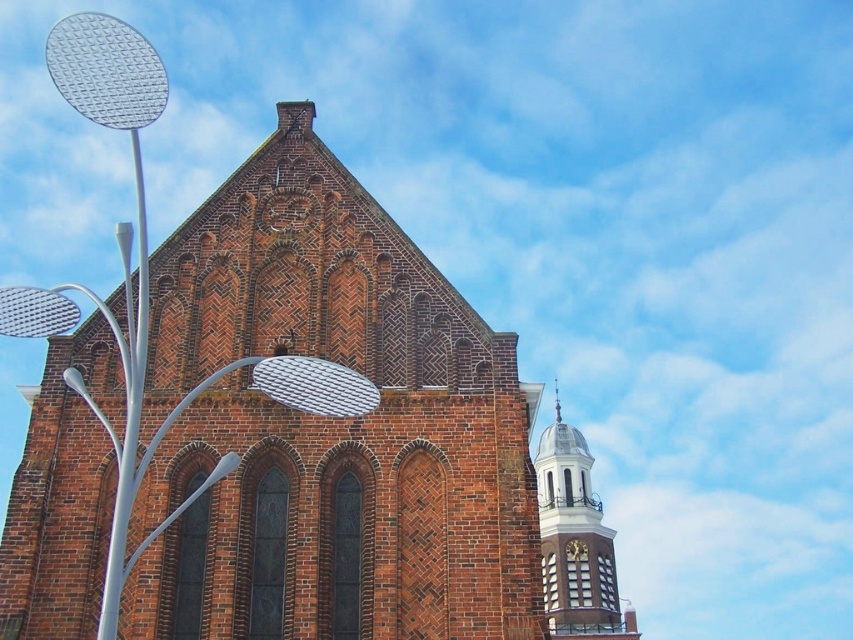
Is red brick church at center taller than white glossy clock tower at upper right?

Incorrect, red brick church at center's height is not larger of white glossy clock tower at upper right's.

Is red brick church at center further to the viewer compared to white glossy clock tower at upper right?

No, it is in front of white glossy clock tower at upper right.

Does point (440, 449) come in front of point (555, 493)?

Yes, point (440, 449) is closer to viewer.

Image resolution: width=853 pixels, height=640 pixels. Find the location of `red brick church at center`. red brick church at center is located at coordinates (347, 436).

Is red brick church at center below gold metallic clock at upper right?

Actually, red brick church at center is above gold metallic clock at upper right.

Does point (412, 291) lie in front of point (567, 545)?

That is True.

Does point (337, 614) come behind point (585, 547)?

No, (337, 614) is in front of (585, 547).

The height and width of the screenshot is (640, 853). Find the location of `red brick church at center`. red brick church at center is located at coordinates point(347,436).

Where is `white glossy clock tower at upper right`? white glossy clock tower at upper right is located at coordinates (575, 538).

Is point (564, 563) more distant than point (569, 545)?

No.

Which is behind, point (566, 422) or point (573, 552)?

The point (566, 422) is behind.

I want to click on white glossy clock tower at upper right, so click(x=575, y=538).